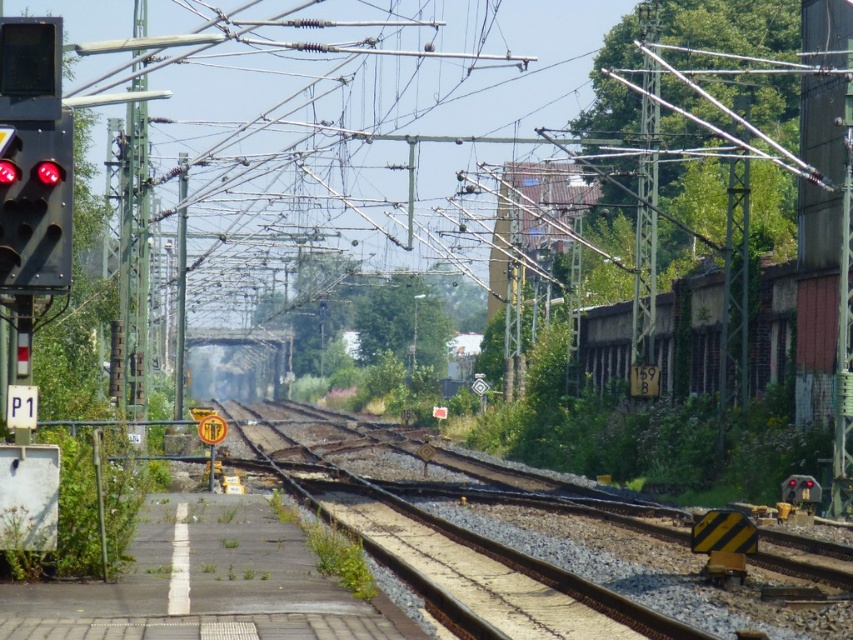
Which of these two, brown gravel train track at center or black matte traffic light at left, stands shorter?

Standing shorter between the two is brown gravel train track at center.

Does brown gravel train track at center have a greater height compared to black matte traffic light at left?

In fact, brown gravel train track at center may be shorter than black matte traffic light at left.

Between point (556, 545) and point (50, 189), which one is positioned behind?

The point (556, 545) is behind.

Identify the location of brown gravel train track at center. The width and height of the screenshot is (853, 640). (468, 534).

Can you confirm if brown gravel train track at center is bigger than green metallic pole at center-right?

Incorrect, brown gravel train track at center is not larger than green metallic pole at center-right.

Between brown gravel train track at center and green metallic pole at center-right, which one appears on the left side from the viewer's perspective?

From the viewer's perspective, brown gravel train track at center appears more on the left side.

You are a GUI agent. You are given a task and a screenshot of the screen. Output one action in this format:
    pyautogui.click(x=<x>, y=<y>)
    Task: Click on the brown gravel train track at center
    
    Given the screenshot: What is the action you would take?
    pyautogui.click(x=468, y=534)

In order to click on brown gravel train track at center in this screenshot , I will do [x=468, y=534].

Is brown gravel train track at center thinner than metallic pole at center?

Indeed, brown gravel train track at center has a lesser width compared to metallic pole at center.

Describe the element at coordinates (468, 534) in the screenshot. I see `brown gravel train track at center` at that location.

Where is `brown gravel train track at center`? brown gravel train track at center is located at coordinates (468, 534).